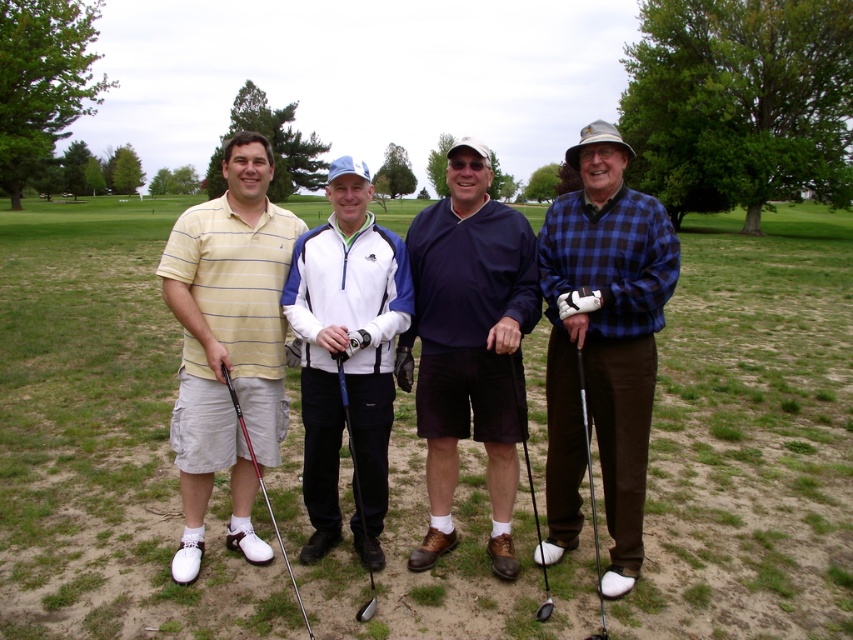
Question: Which object is the closest to the yellow striped polo shirt at left?

Choices:
 (A) metallic shaft at lower right
 (B) metallic silver golf club at center
 (C) green grass at center
 (D) blue plaid shirt at right

Answer: (B)

Question: Considering the real-world distances, which object is farthest from the metallic silver golf club at center?

Choices:
 (A) blue plaid shirt at right
 (B) metallic shaft at lower right
 (C) matte silver golf club at left

Answer: (C)

Question: Where is metallic shaft at lower right located in relation to metallic silver golf club at center in the image?

Choices:
 (A) left
 (B) right

Answer: (B)

Question: Where is blue plaid shirt at right located in relation to metallic silver golf club at center in the image?

Choices:
 (A) right
 (B) left

Answer: (A)

Question: Which object appears closest to the camera in this image?

Choices:
 (A) matte silver golf club at left
 (B) metallic silver golf club at center

Answer: (A)

Question: From the image, what is the correct spatial relationship of yellow striped polo shirt at left in relation to metallic shaft at lower right?

Choices:
 (A) right
 (B) left

Answer: (B)